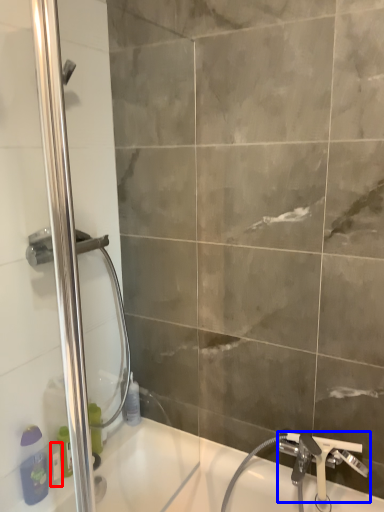
Question: Which object appears farthest to the camera in this image, toiletry (highlighted by a red box) or tap (highlighted by a blue box)?

Choices:
 (A) toiletry
 (B) tap

Answer: (A)